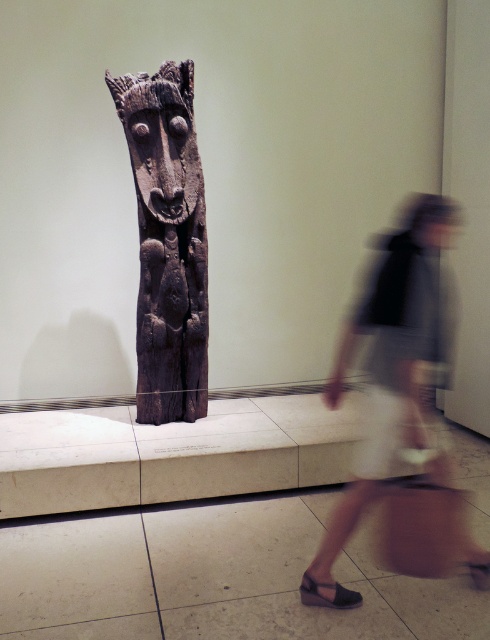
Question: Which of the following is the farthest from the observer?

Choices:
 (A) light beige skirt at lower right
 (B) black leather sandal at lower center
 (C) dark wood carving at center

Answer: (C)

Question: Is light beige skirt at lower right above dark wood carving at center?

Choices:
 (A) no
 (B) yes

Answer: (A)

Question: Is the position of dark wood carving at center less distant than that of black leather sandal at lower center?

Choices:
 (A) yes
 (B) no

Answer: (B)

Question: Is dark wood carving at center in front of black leather sandal at lower center?

Choices:
 (A) yes
 (B) no

Answer: (B)

Question: Which of these objects is positioned closest to the light beige skirt at lower right?

Choices:
 (A) dark wood carving at center
 (B) black leather sandal at lower center

Answer: (B)

Question: Which object appears farthest from the camera in this image?

Choices:
 (A) dark wood carving at center
 (B) black leather sandal at lower center
 (C) light beige skirt at lower right

Answer: (A)